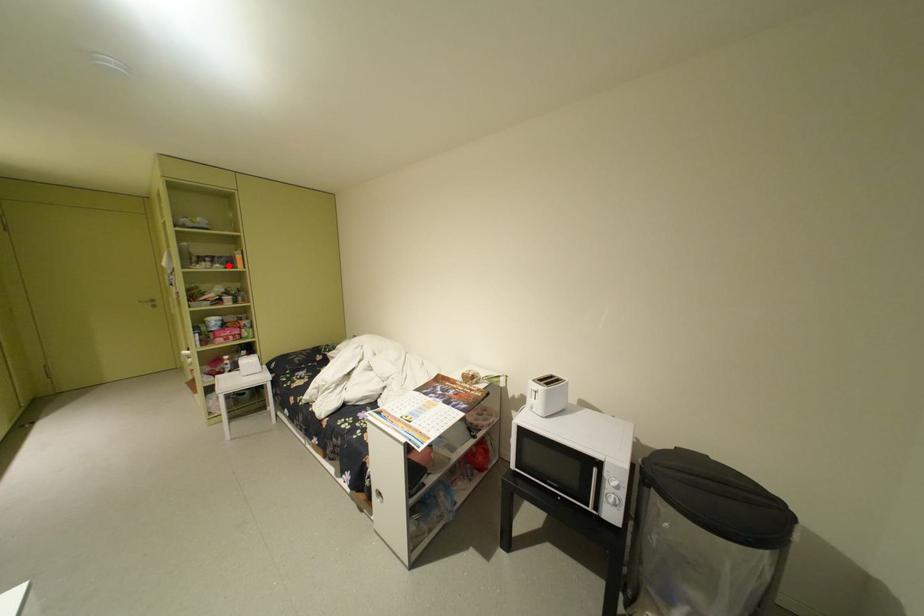
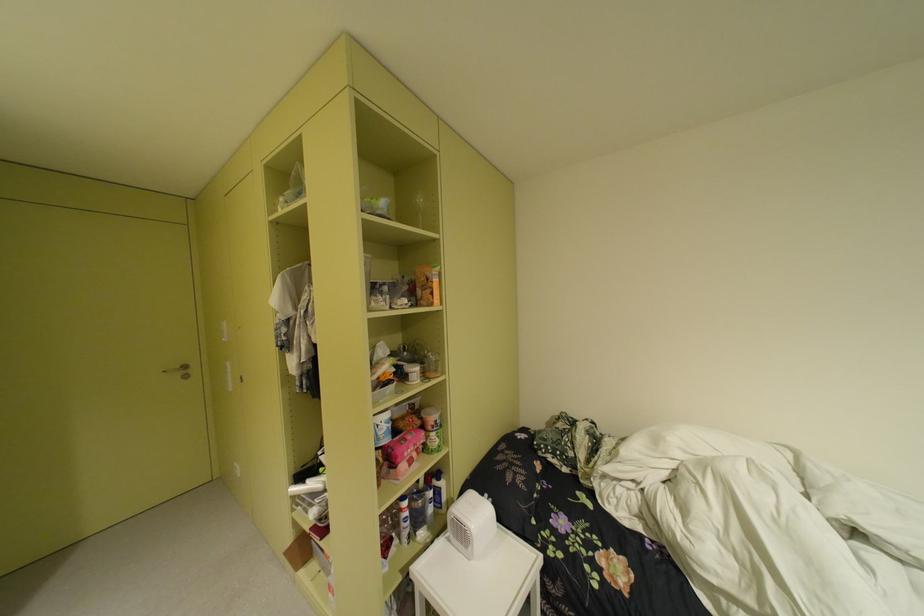
Locate, in the second image, the point that corresponds to the highlighted location in the first image.

(417, 301)